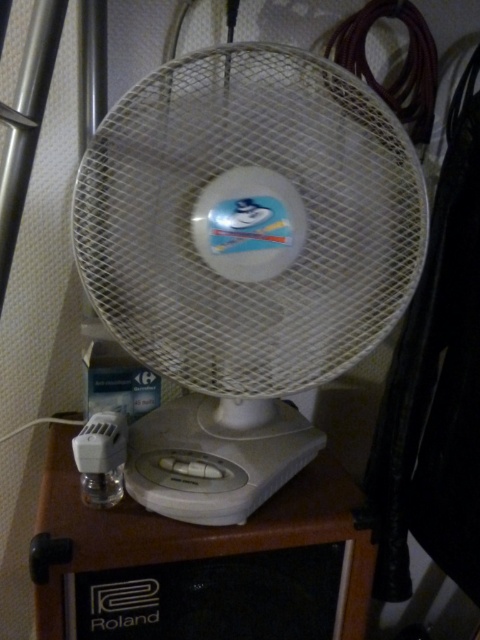
The width and height of the screenshot is (480, 640). Find the location of `white plastic fan at center`. white plastic fan at center is located at coordinates (244, 259).

Measure the distance between point (235, 348) and camera.

The distance of point (235, 348) from camera is 25.43 inches.

You are a GUI agent. You are given a task and a screenshot of the screen. Output one action in this format:
    pyautogui.click(x=<x>, y=<y>)
    Task: Click on the white plastic fan at center
    
    Given the screenshot: What is the action you would take?
    pyautogui.click(x=244, y=259)